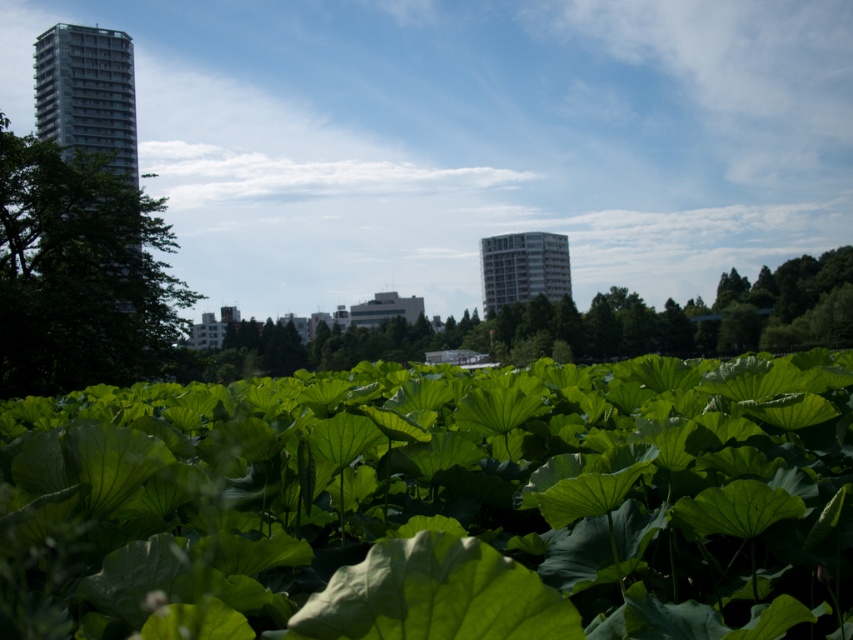
Question: Is green leafy tree at left wider than green leafy plant at center?

Choices:
 (A) no
 (B) yes

Answer: (A)

Question: Which of the following is the farthest from the observer?

Choices:
 (A) green leafy plant at center
 (B) green leafy tree at left

Answer: (A)

Question: Does green leafy tree at left come in front of green leafy plant at center?

Choices:
 (A) yes
 (B) no

Answer: (A)

Question: Which point is farther from the camera taking this photo?

Choices:
 (A) (50, 276)
 (B) (280, 372)

Answer: (B)

Question: Does green leafy tree at left have a greater width compared to green leafy plant at center?

Choices:
 (A) yes
 (B) no

Answer: (B)